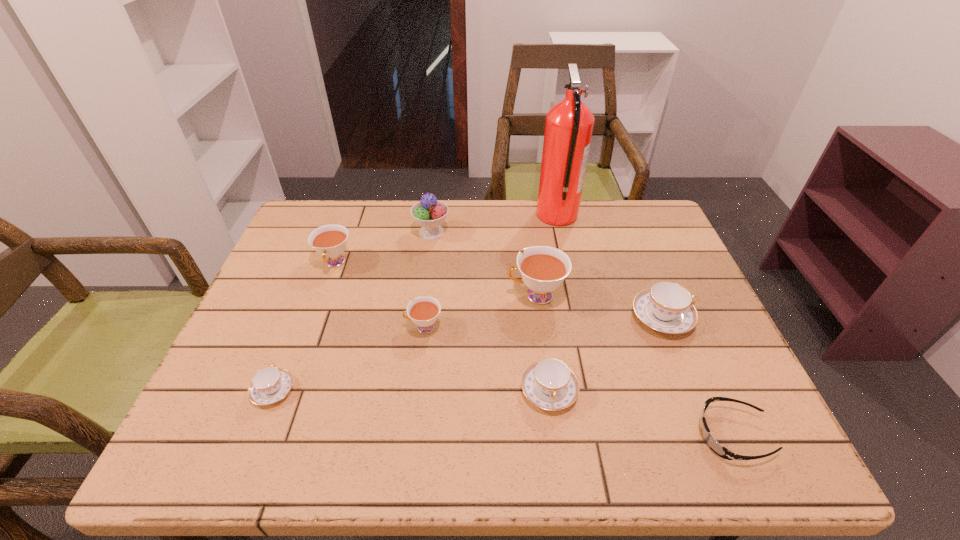
I want to click on free spot between the smallest white teacup and the seventh nearest object, so click(379, 295).

This screenshot has height=540, width=960. I want to click on unoccupied position between the sunglasses and the fire extinguisher, so click(x=645, y=325).

In order to click on vacant region between the shortest object and the eighth tallest object in this screenshot , I will do `click(503, 413)`.

The height and width of the screenshot is (540, 960). Find the location of `vacant area that lies between the second white teacup from right to left and the farthest blue teacup`. vacant area that lies between the second white teacup from right to left and the farthest blue teacup is located at coordinates (542, 322).

Find the location of a particular element. the eighth closest object to the icecream is located at coordinates [x=720, y=450].

The image size is (960, 540). I want to click on object that is the fourth closest to the second tallest object, so click(x=424, y=312).

Identify which teacup is the third nearest to the rightmost white teacup. Please provide its 2D coordinates. Your answer should be formatted as a tuple, i.e. [(x, y)], where the tuple contains the x and y coordinates of a point satisfying the conditions above.

[(424, 312)]

Select which teacup appears as the closest to the shortest object. Please provide its 2D coordinates. Your answer should be formatted as a tuple, i.e. [(x, y)], where the tuple contains the x and y coordinates of a point satisfying the conditions above.

[(666, 307)]

Find the location of a particular element. Image resolution: width=960 pixels, height=540 pixels. the closest white teacup relative to the farthest blue teacup is located at coordinates (543, 269).

Locate an element on the screen. Image resolution: width=960 pixels, height=540 pixels. white teacup that stands as the third closest to the shortest object is located at coordinates (330, 241).